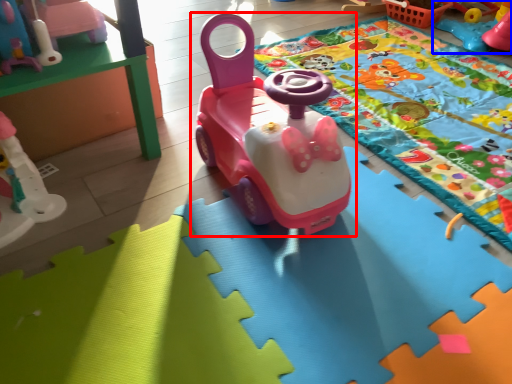
Question: Among these objects, which one is farthest to the camera, toy (highlighted by a red box) or toy (highlighted by a blue box)?

Choices:
 (A) toy
 (B) toy

Answer: (B)